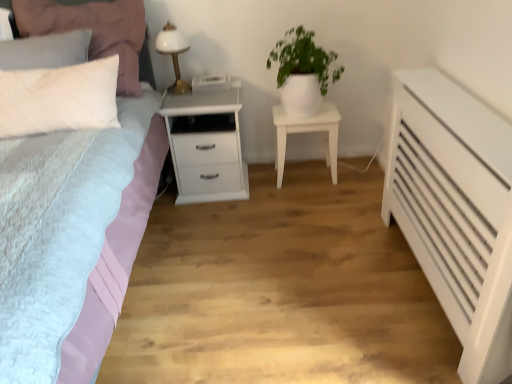
This screenshot has width=512, height=384. What are the coordinates of `vacant space in front of white matte nightstand at center, the 1th nightstand viewed from the right` in the screenshot? It's located at (320, 208).